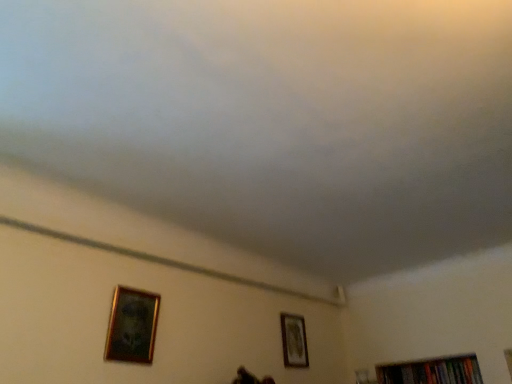
Question: Would you say hardcover books at bottom right is inside or outside gold-framed picture at lower left, which is counted as the 1th picture frame, starting from the top?

Choices:
 (A) outside
 (B) inside

Answer: (A)

Question: Is hardcover books at bottom right bigger or smaller than gold-framed picture at lower left, which ranks as the second picture frame in bottom-to-top order?

Choices:
 (A) small
 (B) big

Answer: (B)

Question: Which is farther from the gold-framed picture at lower right, which is the 2th picture frame in top-to-bottom order?

Choices:
 (A) hardcover books at bottom right
 (B) gold-framed picture at lower left, which is the 1th picture frame from front to back

Answer: (B)

Question: Estimate the real-world distances between objects in this image. Which object is closer to the gold-framed picture at lower left, which is counted as the second picture frame, starting from the back?

Choices:
 (A) hardcover books at bottom right
 (B) gold-framed picture at lower right, which is counted as the second picture frame, starting from the left

Answer: (B)